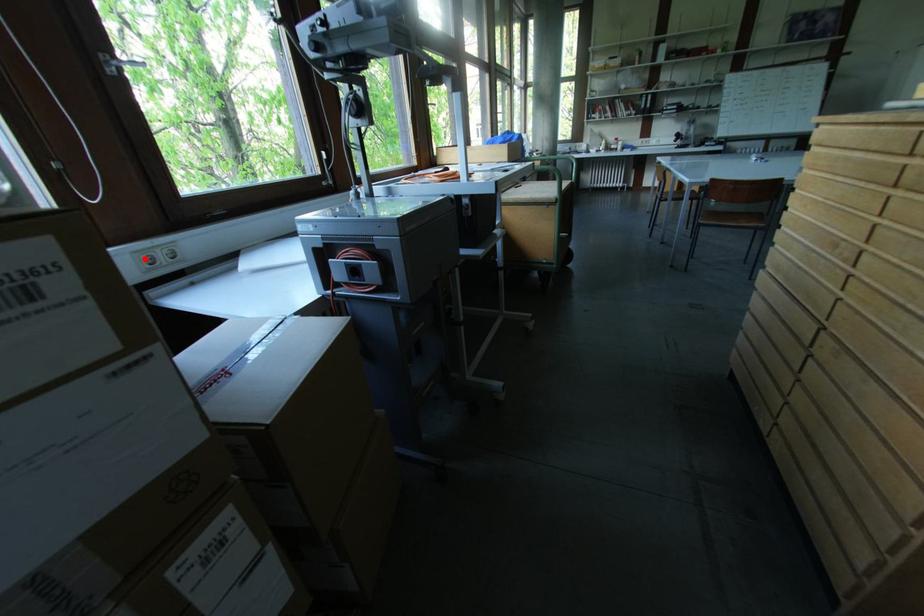
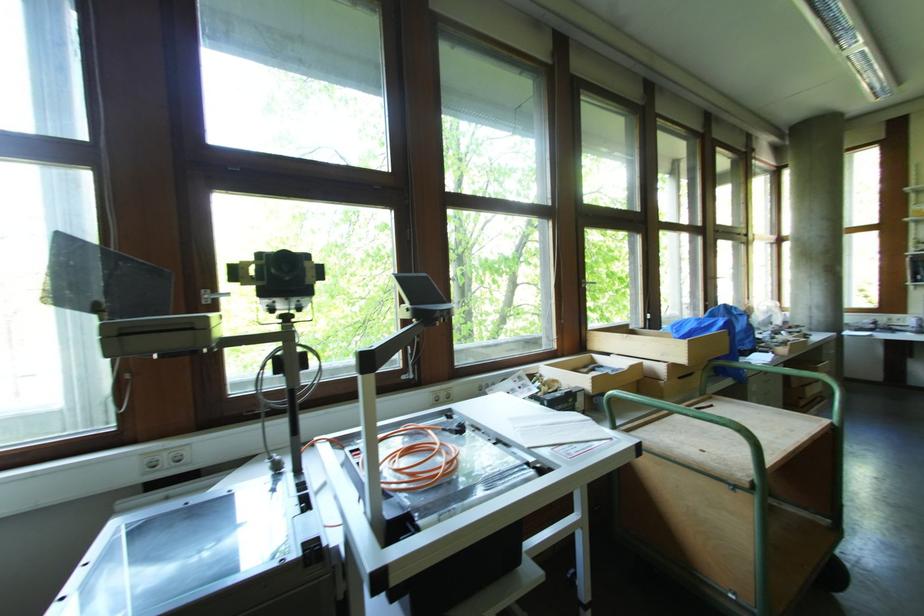
The point at the highlighted location is marked in the first image. Where is the corresponding point in the second image?

(151, 462)